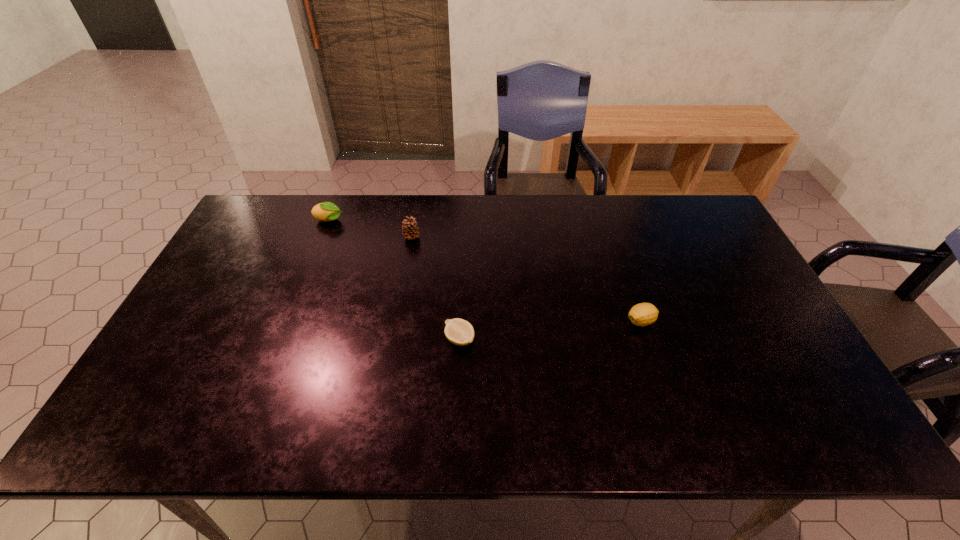
You are a GUI agent. You are given a task and a screenshot of the screen. Output one action in this format:
    pyautogui.click(x=<x>, y=<y>)
    Task: Click on the vacant area at the far right corner
    The height and width of the screenshot is (540, 960).
    Given the screenshot: What is the action you would take?
    pyautogui.click(x=693, y=208)

What are the coordinates of `unoccupied position between the second tallest lemon and the shortest object` in the screenshot? It's located at (550, 330).

What are the coordinates of `empty space between the second farthest object and the second lemon from right to left` in the screenshot? It's located at (436, 288).

Locate an element on the screen. vacant area between the tallest object and the rightmost lemon is located at coordinates (526, 279).

You are a GUI agent. You are given a task and a screenshot of the screen. Output one action in this format:
    pyautogui.click(x=<x>, y=<y>)
    Task: Click on the free point between the tallest object and the shortest object
    The image size is (960, 540).
    Given the screenshot: What is the action you would take?
    pyautogui.click(x=436, y=288)

The height and width of the screenshot is (540, 960). I want to click on unoccupied position between the second farthest object and the shortest object, so click(x=436, y=288).

The height and width of the screenshot is (540, 960). What are the coordinates of `free space between the third object from right to left and the second tallest object` in the screenshot? It's located at (371, 229).

Image resolution: width=960 pixels, height=540 pixels. What are the coordinates of `free space between the third tallest object and the farthest lemon` in the screenshot? It's located at (485, 271).

You are a GUI agent. You are given a task and a screenshot of the screen. Output one action in this format:
    pyautogui.click(x=<x>, y=<y>)
    Task: Click on the free space between the leftmost object and the third tallest object
    The height and width of the screenshot is (540, 960).
    Given the screenshot: What is the action you would take?
    pyautogui.click(x=485, y=271)

Find the location of a particular element. The image size is (960, 540). free spot between the tallest object and the leftmost lemon is located at coordinates (371, 229).